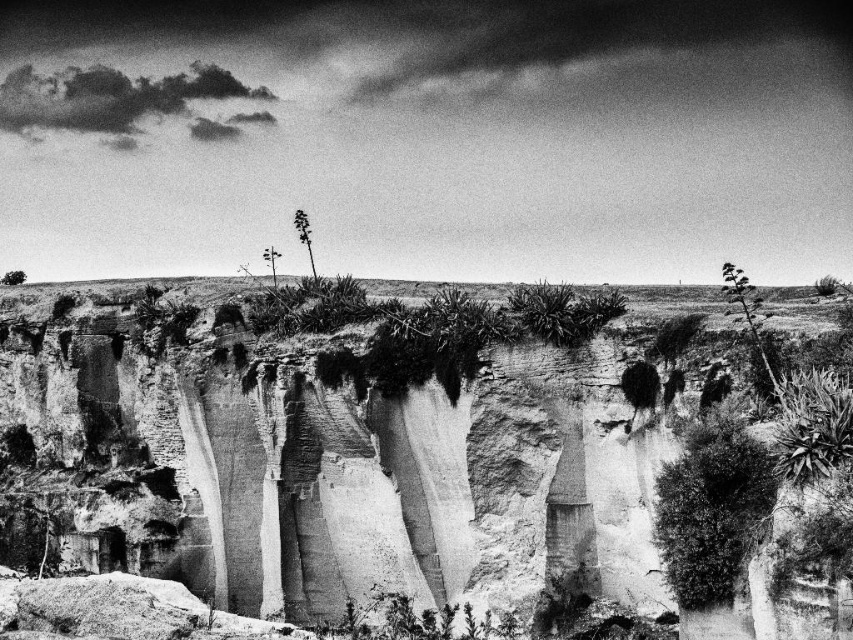
Question: Where is rough textured cliff face at center located in relation to green leafy plant at upper center in the image?

Choices:
 (A) above
 (B) below

Answer: (B)

Question: Which of the following is the farthest from the observer?

Choices:
 (A) (293, 216)
 (B) (751, 326)
 (C) (21, 278)

Answer: (A)

Question: Can you confirm if rough textured cliff face at center is bigger than green leafy tree at upper left?

Choices:
 (A) yes
 (B) no

Answer: (A)

Question: Which object is closer to the camera taking this photo?

Choices:
 (A) green leafy plant at upper center
 (B) thick green foliage at upper right

Answer: (B)

Question: Which of the following is the farthest from the observer?

Choices:
 (A) smooth green tree at center
 (B) green leafy plant at upper center

Answer: (B)

Question: Does thick green foliage at upper right appear on the left side of green leafy tree at upper left?

Choices:
 (A) yes
 (B) no

Answer: (B)